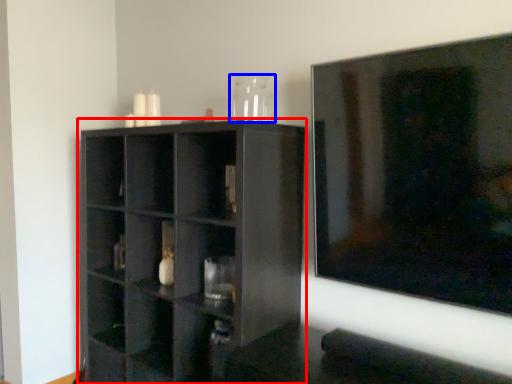
Question: Among these objects, which one is nearest to the camera, shelf (highlighted by a red box) or glass vase (highlighted by a blue box)?

Choices:
 (A) shelf
 (B) glass vase

Answer: (A)